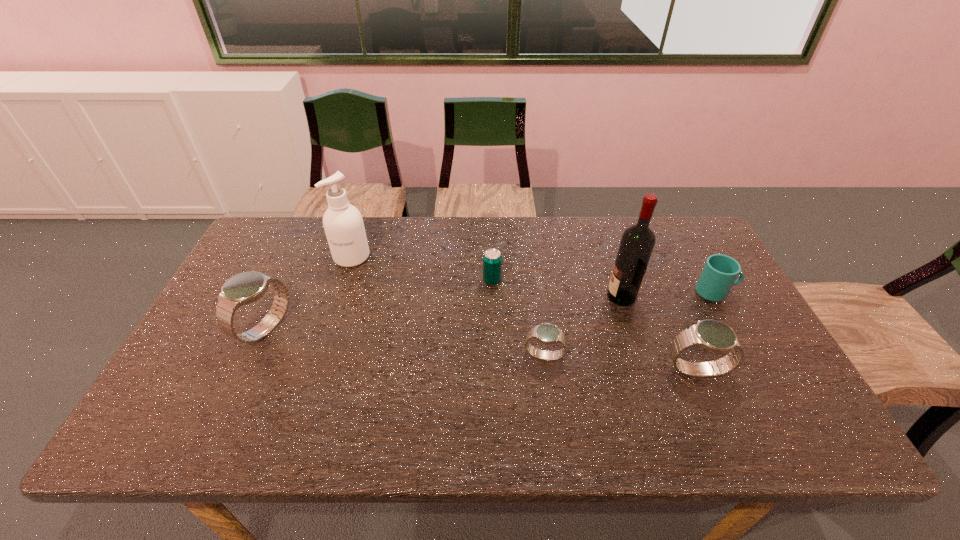
You are a GUI agent. You are given a task and a screenshot of the screen. Output one action in this format:
    pyautogui.click(x=<x>, y=<y>)
    Task: Click on the leftmost watch
    The width and height of the screenshot is (960, 540).
    Given the screenshot: What is the action you would take?
    pyautogui.click(x=244, y=288)

Find the location of `the shortest watch`. the shortest watch is located at coordinates (547, 333).

Locate an element on the screen. the fourth object from left to right is located at coordinates (547, 333).

Where is `the second object from right to left`? the second object from right to left is located at coordinates (712, 335).

This screenshot has width=960, height=540. Find the location of `the rightmost watch`. the rightmost watch is located at coordinates (712, 335).

Locate an element on the screen. The width and height of the screenshot is (960, 540). the sixth shortest object is located at coordinates (343, 223).

The width and height of the screenshot is (960, 540). What are the coordinates of `the farthest object` in the screenshot? It's located at (343, 223).

Locate an element on the screen. the rightmost object is located at coordinates (719, 274).

The width and height of the screenshot is (960, 540). I want to click on alcohol, so click(x=637, y=243).

Locate an element on the screen. This screenshot has width=960, height=540. the third object from left to right is located at coordinates (492, 260).